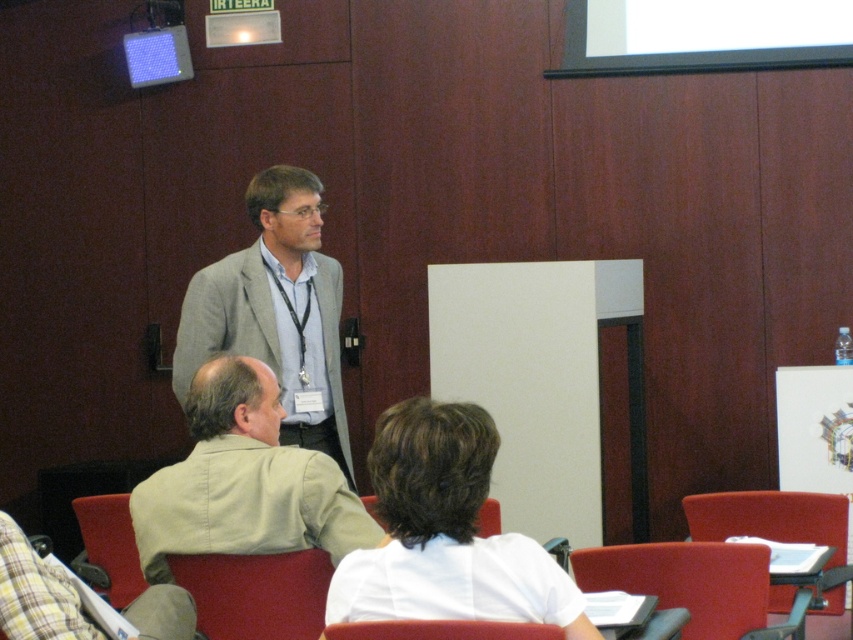
Question: Is gray fabric suit at center closer to the viewer compared to red fabric chair at center?

Choices:
 (A) no
 (B) yes

Answer: (A)

Question: Does red fabric chair at center have a greater width compared to smooth red chair at lower center?

Choices:
 (A) no
 (B) yes

Answer: (B)

Question: Does light beige shirt at lower left have a greater width compared to smooth red chair at lower center?

Choices:
 (A) yes
 (B) no

Answer: (A)

Question: Which point is farther from the camera taking this photo?

Choices:
 (A) (693, 620)
 (B) (251, 404)

Answer: (A)

Question: Which of the following is the closest to the observer?

Choices:
 (A) velvet-like red chair at lower right
 (B) red fabric chair at lower center
 (C) red fabric chair at center

Answer: (B)

Question: Which of the following is the closest to the observer?

Choices:
 (A) light beige shirt at lower left
 (B) red fabric chair at lower center
 (C) red fabric chair at center
 (D) gray fabric suit at center

Answer: (A)